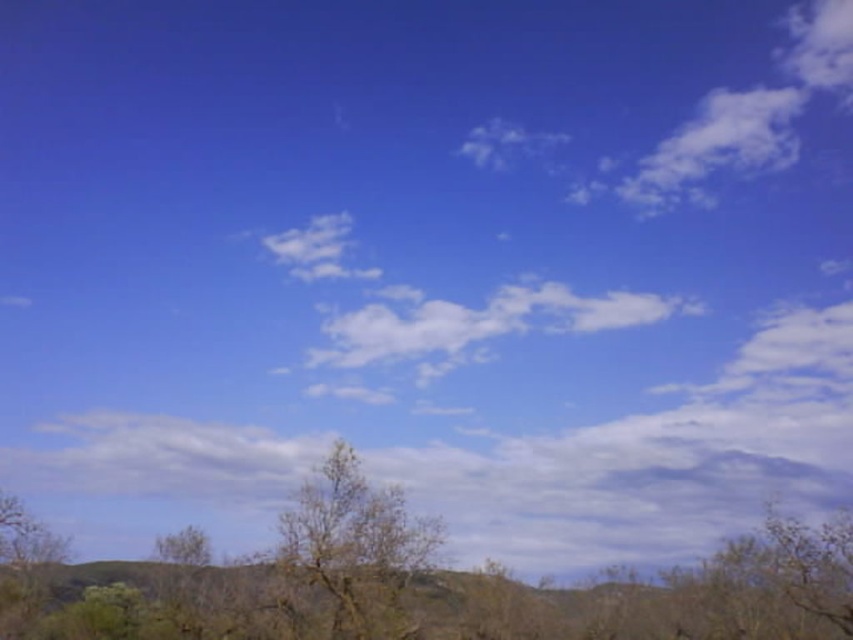
Is brown textured tree at center wider than bare wood tree at lower left?

Indeed, brown textured tree at center has a greater width compared to bare wood tree at lower left.

Which is more to the left, brown textured tree at center or bare wood tree at lower left?

bare wood tree at lower left is more to the left.

Which is in front, point (325, 515) or point (167, 554)?

Positioned in front is point (325, 515).

Where is `brown textured tree at center`? The height and width of the screenshot is (640, 853). brown textured tree at center is located at coordinates (357, 547).